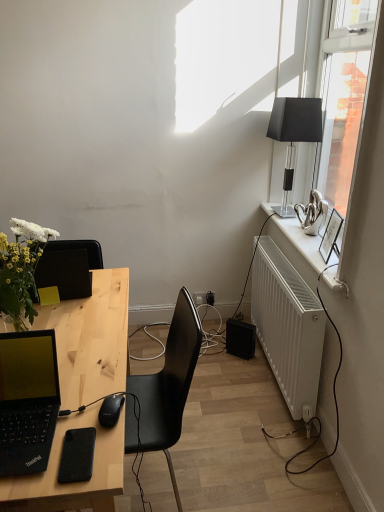
The image size is (384, 512). What do you see at coordinates (240, 338) in the screenshot?
I see `black plastic speaker at lower right` at bounding box center [240, 338].

What is the approximate height of black plastic speaker at lower right?

It is 8.30 inches.

What do you see at coordinates (91, 339) in the screenshot? The height and width of the screenshot is (512, 384). I see `natural wood desk at center` at bounding box center [91, 339].

The image size is (384, 512). In order to click on transparent glass window at upper right in this screenshot , I will do `click(354, 161)`.

The width and height of the screenshot is (384, 512). Describe the element at coordinates (354, 161) in the screenshot. I see `transparent glass window at upper right` at that location.

This screenshot has height=512, width=384. Describe the element at coordinates (302, 242) in the screenshot. I see `white glossy radiator at right` at that location.

Identify the location of black matte laptop at left. (27, 401).

Is black matte mouse at lower left turned away from black matte laptop at left?

No, black matte mouse at lower left is not facing the opposite direction of black matte laptop at left.

From the image's perspective, is black matte mouse at lower left beneath black matte laptop at left?

Yes, from the image's perspective, black matte mouse at lower left is beneath black matte laptop at left.

Is point (102, 410) positioned in front of point (24, 437)?

No.

Is black plastic speaker at lower right facing away from black matte phone at lower left?

black plastic speaker at lower right does not have its back to black matte phone at lower left.

Where is `speaker on the right of black matte phone at lower left`? The height and width of the screenshot is (512, 384). speaker on the right of black matte phone at lower left is located at coordinates (240, 338).

Could black matte phone at lower left be considered to be inside black plastic speaker at lower right?

No.

Looking at this image, from a real-world perspective, who is located higher, black matte laptop at left or transparent glass window at upper right?

In real-world perspective, transparent glass window at upper right is above.

Considering the sizes of objects black matte laptop at left and transparent glass window at upper right in the image provided, who is thinner, black matte laptop at left or transparent glass window at upper right?

Thinner between the two is transparent glass window at upper right.

Is black matte laptop at left beside transparent glass window at upper right?

No, black matte laptop at left is not beside transparent glass window at upper right.

Is black matte laptop at left facing towards transparent glass window at upper right?

No, black matte laptop at left does not turn towards transparent glass window at upper right.

Can we say natural wood desk at center lies outside black plastic power outlet at center?

Indeed, natural wood desk at center is completely outside black plastic power outlet at center.

Where is `desk in front of the black plastic power outlet at center`? Image resolution: width=384 pixels, height=512 pixels. desk in front of the black plastic power outlet at center is located at coordinates (91, 339).

Can you confirm if natural wood desk at center is positioned to the left of black plastic power outlet at center?

Yes, natural wood desk at center is to the left of black plastic power outlet at center.

Is natural wood desk at center positioned behind black plastic power outlet at center?

No, natural wood desk at center is closer to the camera.

Which of these two, black plastic power outlet at center or black plastic speaker at lower right, is wider?

black plastic speaker at lower right.

Is black plastic power outlet at center smaller than black plastic speaker at lower right?

Indeed, black plastic power outlet at center has a smaller size compared to black plastic speaker at lower right.

Are black plastic power outlet at center and black plastic speaker at lower right beside each other?

No, black plastic power outlet at center is not with black plastic speaker at lower right.

Find the location of a particular element. speaker below the black plastic power outlet at center (from the image's perspective) is located at coordinates (240, 338).

Between black matte mouse at lower left and white matte radiator at right, which one has more height?

With more height is white matte radiator at right.

Consider the image. From a real-world perspective, is black matte mouse at lower left physically below white matte radiator at right?

No, from a real-world perspective, black matte mouse at lower left is not under white matte radiator at right.

Which of these two, black matte mouse at lower left or white matte radiator at right, is thinner?

With smaller width is black matte mouse at lower left.

Which of these two, natural wood desk at center or black glass lamp at upper right, stands taller?

Standing taller between the two is natural wood desk at center.

Is natural wood desk at center oriented towards black glass lamp at upper right?

No, natural wood desk at center is not turned towards black glass lamp at upper right.

Where is `desk on the left of black glass lamp at upper right`? This screenshot has width=384, height=512. desk on the left of black glass lamp at upper right is located at coordinates (91, 339).

At what (x,y) coordinates should I click in order to perform the action: click on mouse directly beneath the black matte laptop at left (from a real-world perspective). Please return your answer as a coordinate pair (x, y). The image size is (384, 512). Looking at the image, I should click on (110, 410).

In the image, there is a black plastic speaker at lower right. At what (x,y) coordinates should I click in order to perform the action: click on gadget above it (from the image's perspective). Please return your answer as a coordinate pair (x, y). This screenshot has width=384, height=512. Looking at the image, I should click on (77, 455).

When comparing their distances from black plastic power outlet at center, does white matte radiator at right or black matte phone at lower left seem closer?

Among the two, white matte radiator at right is located nearer to black plastic power outlet at center.

Which object lies nearer to the anchor point black plastic power outlet at center, black matte phone at lower left or white matte radiator at right?

white matte radiator at right is positioned closer to the anchor black plastic power outlet at center.

Estimate the real-world distances between objects in this image. Which object is closer to black matte laptop at left, white matte radiator at right or black plastic speaker at lower right?

white matte radiator at right is closer to black matte laptop at left.

Which object lies nearer to the anchor point transparent glass window at upper right, black matte mouse at lower left or black plastic power outlet at center?

Based on the image, black matte mouse at lower left appears to be nearer to transparent glass window at upper right.

Considering their positions, is black matte laptop at left positioned closer to black matte phone at lower left than black glass lamp at upper right?

black matte laptop at left.

Considering their positions, is black matte laptop at left positioned closer to transparent glass window at upper right than white matte radiator at right?

The object closer to transparent glass window at upper right is white matte radiator at right.

Considering their positions, is black plastic speaker at lower right positioned closer to black matte phone at lower left than natural wood desk at center?

Answer: natural wood desk at center is positioned closer to the anchor black matte phone at lower left.

Looking at the image, which one is located closer to transparent glass window at upper right, black matte laptop at left or black glass lamp at upper right?

Based on the image, black glass lamp at upper right appears to be nearer to transparent glass window at upper right.

The height and width of the screenshot is (512, 384). Find the location of `window between black matte mouse at lower left and black plastic power outlet at center from front to back`. window between black matte mouse at lower left and black plastic power outlet at center from front to back is located at coordinates (354, 161).

This screenshot has width=384, height=512. I want to click on gadget situated between black matte laptop at left and white matte radiator at right from left to right, so click(x=77, y=455).

Identify the location of window between natural wood desk at center and black plastic power outlet at center along the z-axis. click(x=354, y=161).

Identify the location of window between black matte phone at lower left and black plastic power outlet at center from front to back. This screenshot has height=512, width=384. tap(354, 161).